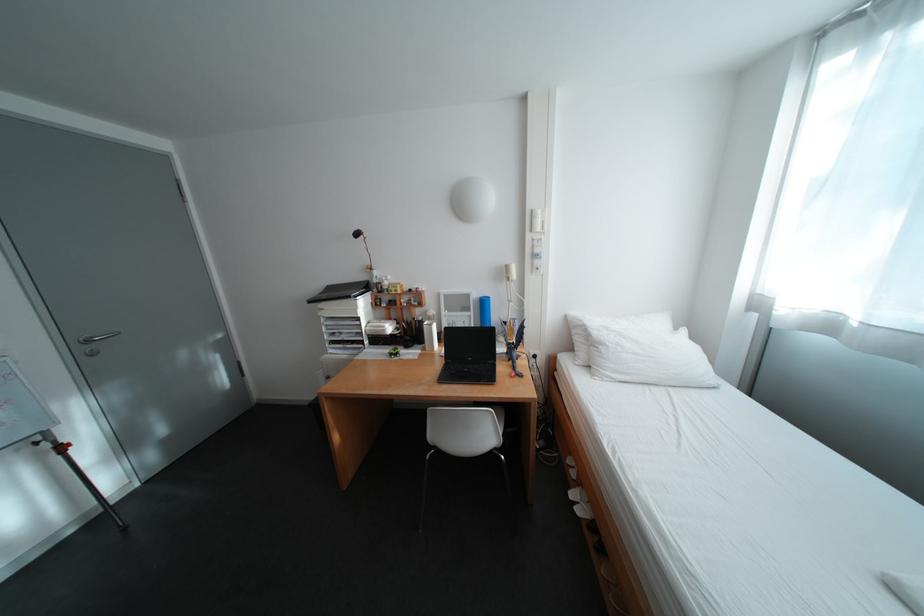
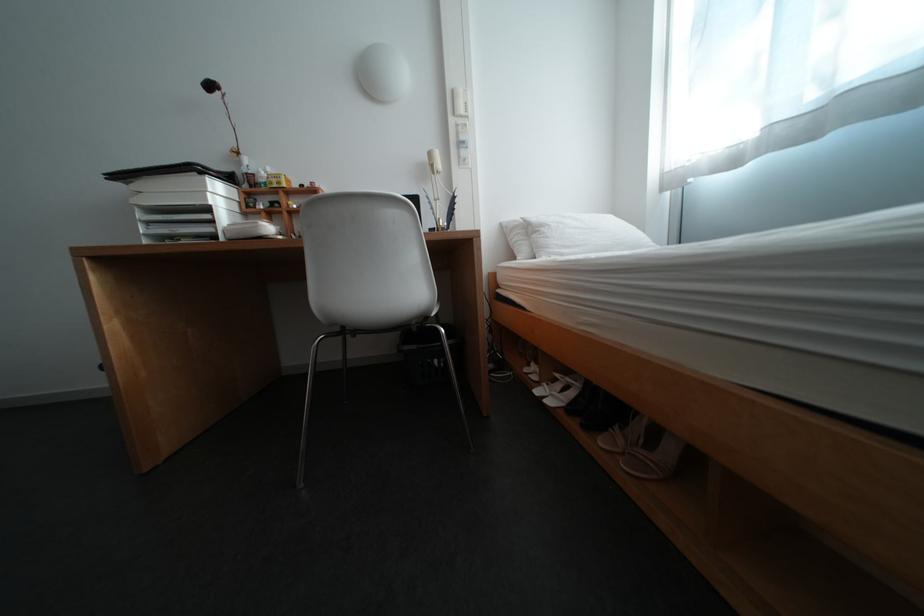
Find the pixel in the second image that matches (x=614, y=346) in the first image.

(555, 228)